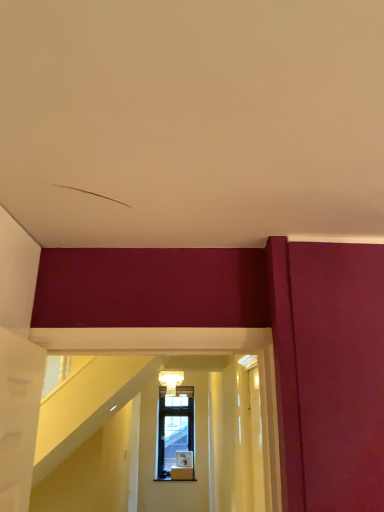
Question: Is matte white light fixture at center behind transparent glass door at right?

Choices:
 (A) no
 (B) yes

Answer: (B)

Question: Can you confirm if matte white light fixture at center is bigger than transparent glass door at right?

Choices:
 (A) yes
 (B) no

Answer: (B)

Question: From the image's perspective, does matte white light fixture at center appear lower than transparent glass door at right?

Choices:
 (A) yes
 (B) no

Answer: (A)

Question: Is matte white light fixture at center to the right of transparent glass door at right from the viewer's perspective?

Choices:
 (A) yes
 (B) no

Answer: (B)

Question: Is matte white light fixture at center to the left of transparent glass door at right from the viewer's perspective?

Choices:
 (A) yes
 (B) no

Answer: (A)

Question: Does matte white light fixture at center come in front of transparent glass door at right?

Choices:
 (A) no
 (B) yes

Answer: (A)

Question: Can you confirm if transparent glass door at right is taller than matte white light fixture at center?

Choices:
 (A) yes
 (B) no

Answer: (A)

Question: Can you confirm if transparent glass door at right is bigger than matte white light fixture at center?

Choices:
 (A) yes
 (B) no

Answer: (A)

Question: Is transparent glass door at right positioned with its back to matte white light fixture at center?

Choices:
 (A) yes
 (B) no

Answer: (B)

Question: From a real-world perspective, is transparent glass door at right under matte white light fixture at center?

Choices:
 (A) no
 (B) yes

Answer: (B)

Question: Is the depth of transparent glass door at right greater than that of matte white light fixture at center?

Choices:
 (A) yes
 (B) no

Answer: (B)

Question: Is transparent glass door at right far from matte white light fixture at center?

Choices:
 (A) no
 (B) yes

Answer: (B)

Question: From the image's perspective, is transparent glass door at right positioned above or below matte white light fixture at center?

Choices:
 (A) above
 (B) below

Answer: (A)